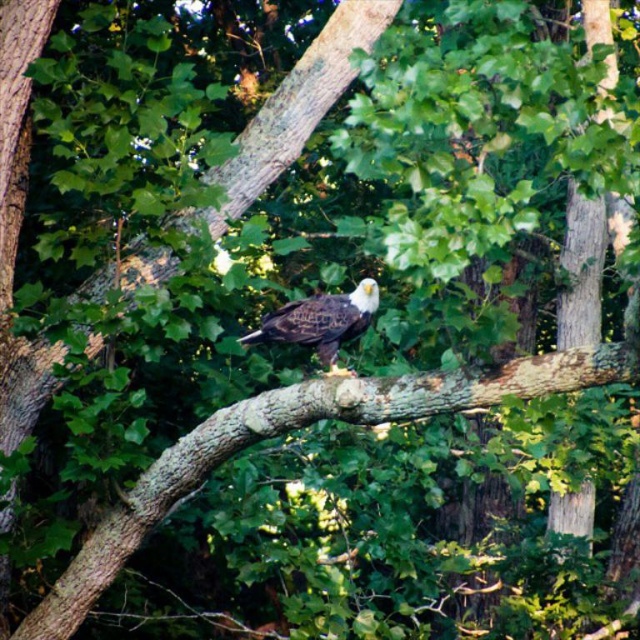
You are a birdwatcher trying to locate the bald eagle in the image. The coordinates given are for a specific point in the image. Which object is located at the coordinates point (294, 428)?

The point (294, 428) marks the brown rough tree branch at center where the bald eagle is perched.

You are a wildlife photographer standing at the camera position. You want to capture a closeup shot of the brown rough tree branch at center. Considering your current distance, is it feasible to take this photo without moving closer?

The brown rough tree branch at center is 6.40 meters away from the camera. Since you are at the camera position, you can use a telephoto lens to zoom in and capture a closeup shot without needing to move closer.